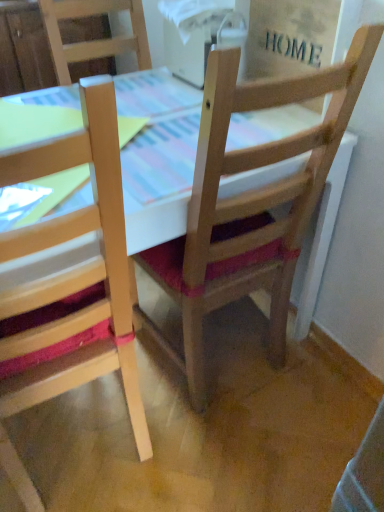
Question: Is wooden chair at center, acting as the 2th chair starting from the left, wider than natural wood chair at left, the second chair viewed from the right?

Choices:
 (A) yes
 (B) no

Answer: (B)

Question: Can you confirm if wooden chair at center, acting as the 2th chair starting from the left, is positioned to the left of natural wood chair at left, the second chair viewed from the right?

Choices:
 (A) no
 (B) yes

Answer: (A)

Question: Can natural wood chair at left, the second chair viewed from the right, be found inside wooden chair at center, which is the 1th chair in right-to-left order?

Choices:
 (A) no
 (B) yes

Answer: (A)

Question: Is wooden chair at center, which is the 1th chair in right-to-left order, oriented away from natural wood chair at left, the second chair viewed from the right?

Choices:
 (A) no
 (B) yes

Answer: (A)

Question: Can you confirm if wooden chair at center, which is the 1th chair in right-to-left order, is bigger than natural wood chair at left, placed as the first chair when sorted from left to right?

Choices:
 (A) yes
 (B) no

Answer: (B)

Question: Is natural wood chair at left, placed as the first chair when sorted from left to right, wider or thinner than wooden table at center?

Choices:
 (A) wide
 (B) thin

Answer: (B)

Question: Is natural wood chair at left, the second chair viewed from the right, in front of or behind wooden table at center in the image?

Choices:
 (A) front
 (B) behind

Answer: (A)

Question: Considering the positions of natural wood chair at left, placed as the first chair when sorted from left to right, and wooden table at center in the image, is natural wood chair at left, placed as the first chair when sorted from left to right, bigger or smaller than wooden table at center?

Choices:
 (A) big
 (B) small

Answer: (B)

Question: From their relative heights in the image, would you say natural wood chair at left, placed as the first chair when sorted from left to right, is taller or shorter than wooden table at center?

Choices:
 (A) tall
 (B) short

Answer: (A)

Question: Looking at the image, does natural wood chair at left, the second chair viewed from the right, seem bigger or smaller compared to wooden chair at center, acting as the 2th chair starting from the left?

Choices:
 (A) big
 (B) small

Answer: (A)

Question: Is natural wood chair at left, the second chair viewed from the right, to the left or to the right of wooden chair at center, which is the 1th chair in right-to-left order, in the image?

Choices:
 (A) right
 (B) left

Answer: (B)

Question: Is natural wood chair at left, the second chair viewed from the right, spatially inside wooden chair at center, which is the 1th chair in right-to-left order, or outside of it?

Choices:
 (A) outside
 (B) inside

Answer: (A)

Question: Is natural wood chair at left, placed as the first chair when sorted from left to right, taller or shorter than wooden chair at center, acting as the 2th chair starting from the left?

Choices:
 (A) tall
 (B) short

Answer: (A)

Question: Looking at their shapes, would you say wooden table at center is wider or thinner than natural wood chair at left, the second chair viewed from the right?

Choices:
 (A) thin
 (B) wide

Answer: (B)

Question: From the image's perspective, is wooden table at center above or below natural wood chair at left, placed as the first chair when sorted from left to right?

Choices:
 (A) below
 (B) above

Answer: (B)